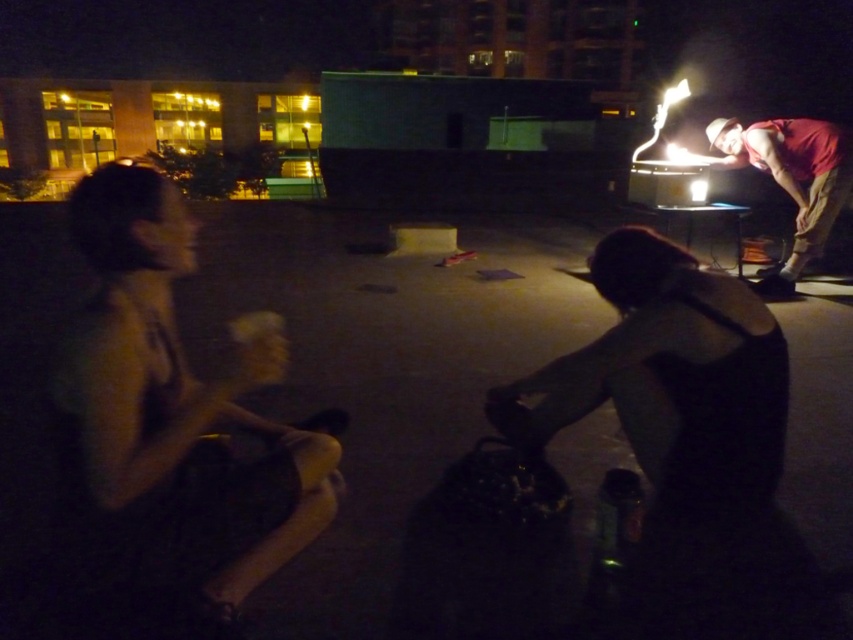
You are standing in the nighttime scene and want to locate the two people wearing different colored shirts. Which direction should you look first to find the dark skin tone shirt at left compared to the red fabric shirt at right?

The dark skin tone shirt at left is to the left of the red fabric shirt at right, so you should look to the left side first to find the dark skin tone shirt at left before looking towards the right for the red fabric shirt at right.